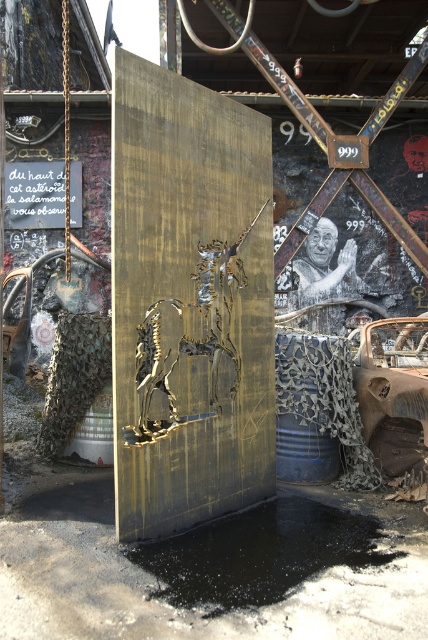
Question: Is gold metallic horse at center in front of rusty metal car at lower right?

Choices:
 (A) no
 (B) yes

Answer: (B)

Question: Among these points, which one is nearest to the camera?

Choices:
 (A) (214, 243)
 (B) (160, 570)

Answer: (B)

Question: Which point appears closest to the camera in this image?

Choices:
 (A) (235, 275)
 (B) (252, 577)

Answer: (B)

Question: Does black glossy puddle at lower center appear under rusty metal car at lower right?

Choices:
 (A) yes
 (B) no

Answer: (A)

Question: Estimate the real-world distances between objects in this image. Which object is closer to the black glossy puddle at lower center?

Choices:
 (A) gold metallic horse at center
 (B) rusty metal car at lower right

Answer: (A)

Question: Is black glossy puddle at lower center positioned at the back of gold metallic horse at center?

Choices:
 (A) yes
 (B) no

Answer: (B)